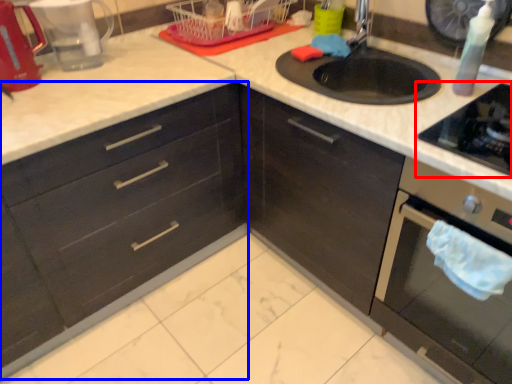
Question: Which of the following is the closest to the observer, gas stove (highlighted by a red box) or cabinetry (highlighted by a blue box)?

Choices:
 (A) gas stove
 (B) cabinetry

Answer: (A)